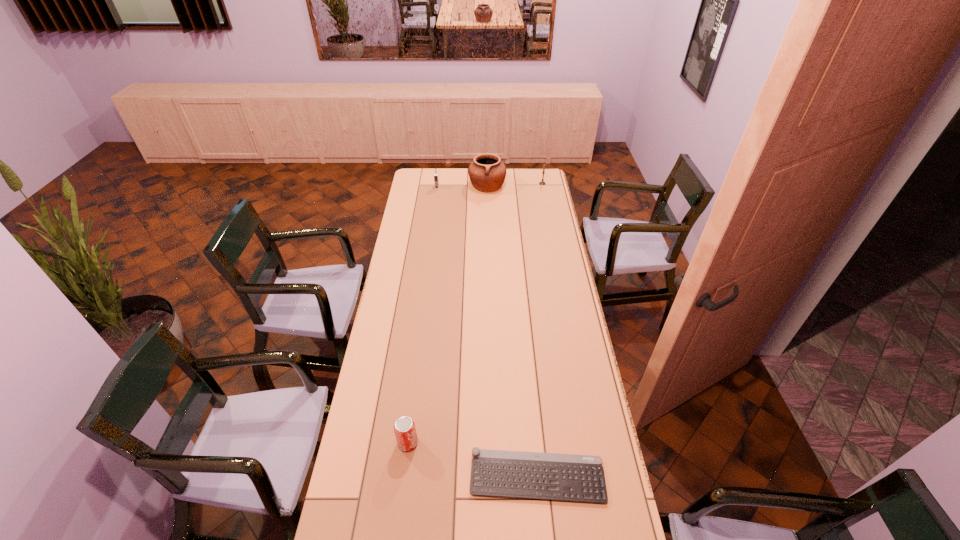
Find the location of a particular element. This screenshot has width=960, height=540. pottery is located at coordinates (487, 173).

The height and width of the screenshot is (540, 960). Identify the location of cellular telephone. (436, 180).

The width and height of the screenshot is (960, 540). I want to click on candle, so click(x=543, y=172).

Where is `soda can`? Image resolution: width=960 pixels, height=540 pixels. soda can is located at coordinates (404, 428).

Locate an element on the screen. computer keyboard is located at coordinates (533, 475).

At what (x,y) coordinates should I click in order to perform the action: click on free space located on the left of the pottery. Please return your answer as a coordinate pair (x, y). The height and width of the screenshot is (540, 960). Looking at the image, I should click on (423, 185).

Find the location of a particular element. Image resolution: width=960 pixels, height=540 pixels. vacant space situated 0.060m on the front-facing side of the cellular telephone is located at coordinates (436, 195).

The width and height of the screenshot is (960, 540). I want to click on vacant space located 0.190m on the left of the candle, so click(x=508, y=184).

Image resolution: width=960 pixels, height=540 pixels. Find the location of `free space located 0.200m on the front of the soda can`. free space located 0.200m on the front of the soda can is located at coordinates (398, 519).

Find the location of a particular element. The height and width of the screenshot is (540, 960). free region located 0.140m on the back of the computer keyboard is located at coordinates (531, 412).